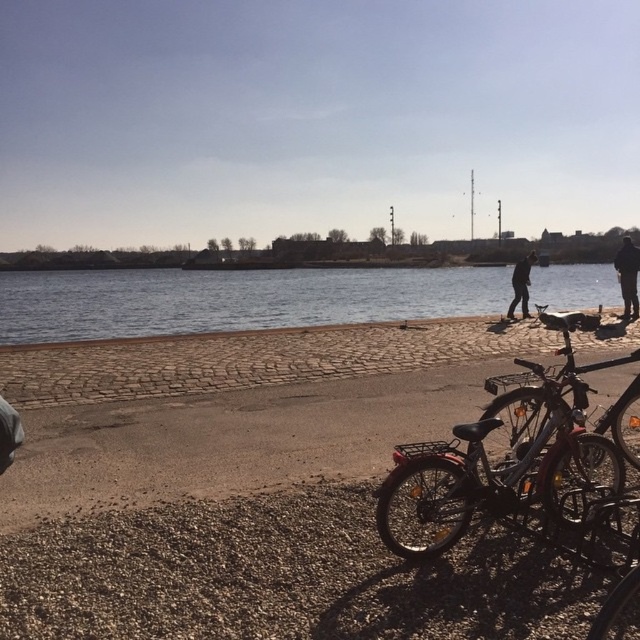
Question: Is shiny metallic bicycle at center smaller than dark gray pants at right?

Choices:
 (A) no
 (B) yes

Answer: (B)

Question: Observing the image, what is the correct spatial positioning of dark gray pants at right in reference to black fabric jacket at center?

Choices:
 (A) below
 (B) above

Answer: (B)

Question: Which object is closer to the camera taking this photo?

Choices:
 (A) shiny metallic bicycle at center
 (B) black fabric jacket at center
 (C) blue water at center

Answer: (A)

Question: Among these points, which one is farthest from the camera?

Choices:
 (A) (624, 237)
 (B) (584, 387)
 (C) (419, 268)
 (D) (525, 259)

Answer: (C)

Question: Which point is closer to the camera?

Choices:
 (A) black fabric jacket at center
 (B) shiny metallic bicycle at center
 (C) dark gray pants at right

Answer: (B)

Question: Does shiny metallic bicycle at center appear on the left side of dark gray pants at right?

Choices:
 (A) yes
 (B) no

Answer: (A)